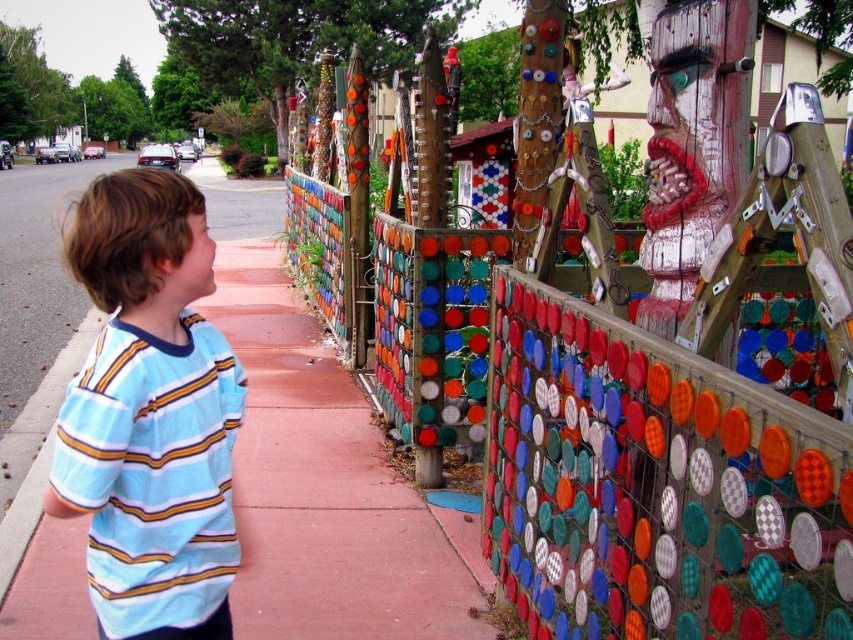
Question: Does multicolored mosaic fence at center lie in front of pink concrete sidewalk at center?

Choices:
 (A) no
 (B) yes

Answer: (B)

Question: Estimate the real-world distances between objects in this image. Which object is closer to the blue striped shirt at left?

Choices:
 (A) multicolored mosaic fence at center
 (B) pink concrete sidewalk at center

Answer: (A)

Question: Is pink concrete sidewalk at center bigger than blue striped shirt at left?

Choices:
 (A) yes
 (B) no

Answer: (A)

Question: Which point is closer to the camera?

Choices:
 (A) (230, 572)
 (B) (527, 522)
 (C) (405, 596)

Answer: (A)

Question: Can you confirm if multicolored mosaic fence at center is thinner than blue striped shirt at left?

Choices:
 (A) no
 (B) yes

Answer: (A)

Question: Which of the following is the closest to the observer?

Choices:
 (A) (1, 464)
 (B) (212, 490)

Answer: (B)